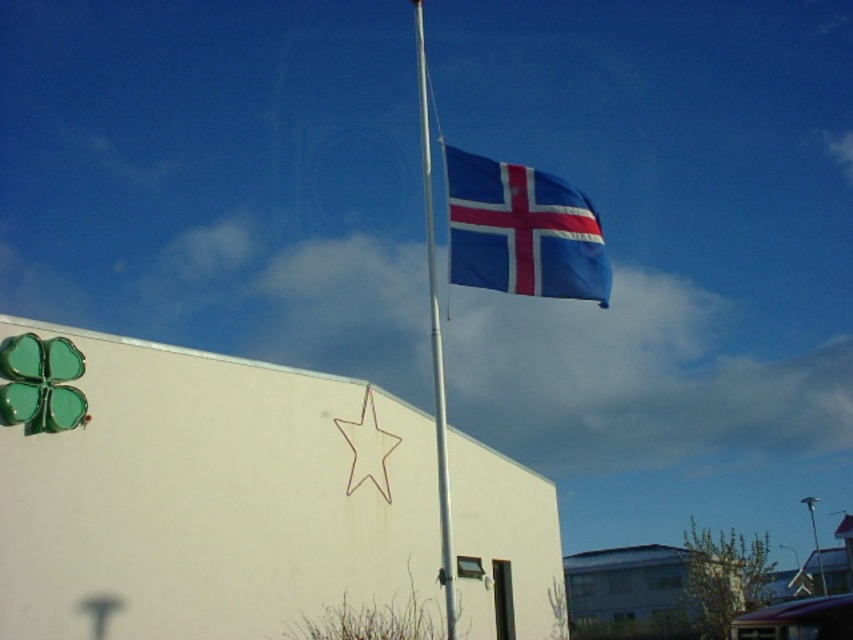
You are a GUI agent. You are given a task and a screenshot of the screen. Output one action in this format:
    pyautogui.click(x=<x>, y=<y>)
    Task: Click on the blue fabric flag at upper center
    
    Given the screenshot: What is the action you would take?
    pyautogui.click(x=521, y=230)

Does blue fabric flag at upper center lie behind silver metallic flag pole at center?

Yes, blue fabric flag at upper center is behind silver metallic flag pole at center.

Where is `blue fabric flag at upper center`? blue fabric flag at upper center is located at coordinates (521, 230).

Which is in front, point (596, 275) or point (824, 625)?

Positioned in front is point (824, 625).

Can you confirm if blue fabric flag at upper center is wider than purple fabric at lower right?

No, blue fabric flag at upper center is not wider than purple fabric at lower right.

Locate an element on the screen. This screenshot has width=853, height=640. blue fabric flag at upper center is located at coordinates (521, 230).

This screenshot has height=640, width=853. Identify the location of blue fabric flag at upper center. (521, 230).

Who is positioned more to the left, silver metallic flag pole at center or purple fabric at lower right?

silver metallic flag pole at center

Based on the photo, does silver metallic flag pole at center appear on the left side of purple fabric at lower right?

Correct, you'll find silver metallic flag pole at center to the left of purple fabric at lower right.

At what (x,y) coordinates should I click in order to perform the action: click on silver metallic flag pole at center. Please return your answer as a coordinate pair (x, y). The width and height of the screenshot is (853, 640). Looking at the image, I should click on (434, 340).